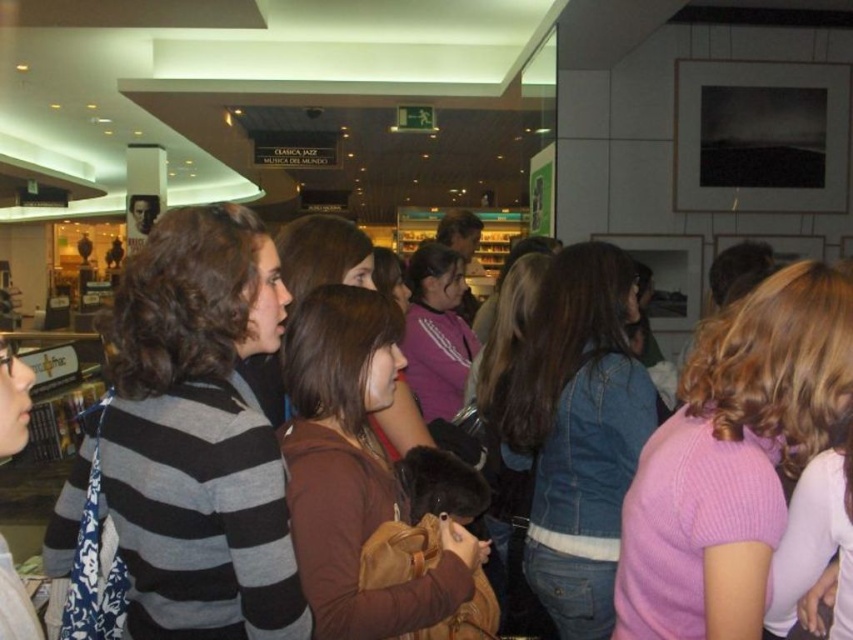
You are standing in the shopping mall and want to take a photo of the scene. Your camera has a focal length of 50mm and you want to ensure that the point at point coordinates point (610, 260) is in focus. What is the minimum distance in feet that the camera should be focused on to capture this point clearly?

The minimum distance the camera should be focused on to capture the point at point coordinates point (610, 260) clearly is 7.22 feet, as that is the distance of the point from the camera.

You are a fashion designer observing the crowd in the mall. You see a striped sweater at center and a brown matte sweater at center. Can you determine if there is enough space between them to comfortably fit a third sweater of average size between them?

The striped sweater at center and brown matte sweater at center are 7.89 inches apart from each other. An average sweater is about 12 inches wide, so there isn not enough space between them to fit a third sweater.